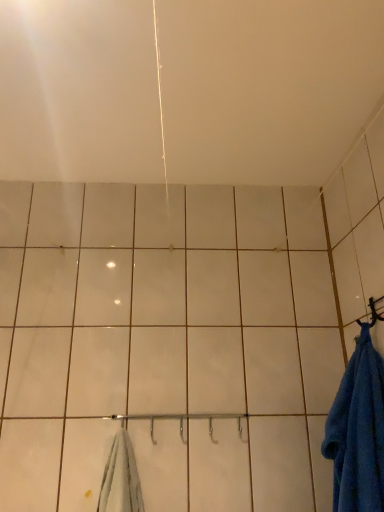
Question: Should I look upward or downward to see blue fabric hanger at right?

Choices:
 (A) up
 (B) down

Answer: (B)